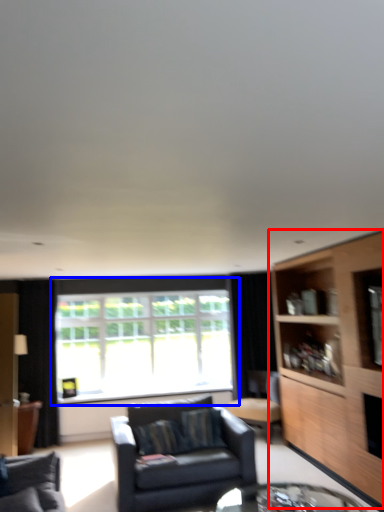
Question: Which of the following is the farthest to the observer, cabinetry (highlighted by a red box) or window (highlighted by a blue box)?

Choices:
 (A) cabinetry
 (B) window

Answer: (B)